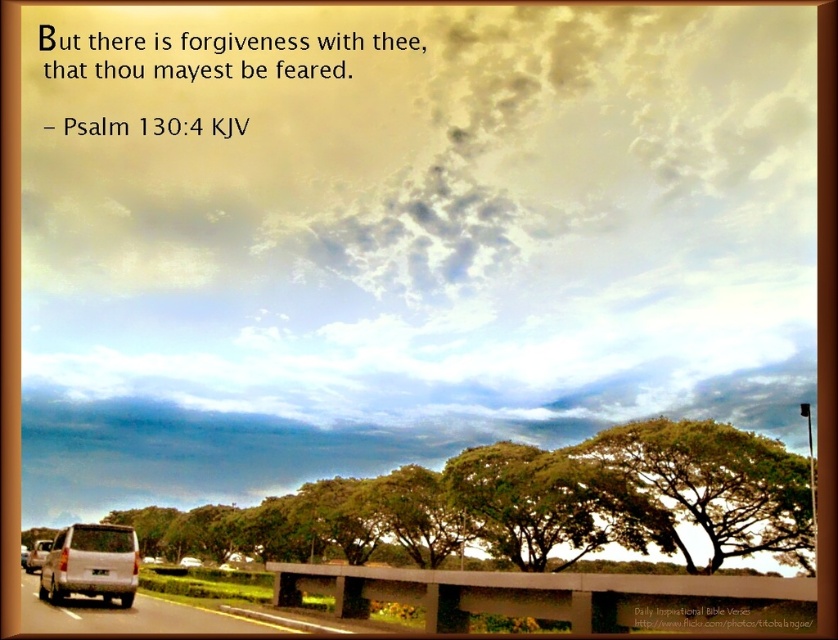
Question: Is silver metallic van at lower left positioned in front of metallic silver car at lower left?

Choices:
 (A) no
 (B) yes

Answer: (B)

Question: Estimate the real-world distances between objects in this image. Which object is closer to the silver metallic van at lower left?

Choices:
 (A) metallic silver car at lower left
 (B) green leafy tree at center

Answer: (A)

Question: Which point is closer to the camera taking this photo?

Choices:
 (A) (83, 525)
 (B) (27, 563)
 (C) (789, 545)

Answer: (A)

Question: Can you confirm if silver metallic van at lower left is positioned above metallic silver car at lower left?

Choices:
 (A) no
 (B) yes

Answer: (B)

Question: Can you confirm if green leafy tree at center is thinner than metallic silver car at lower left?

Choices:
 (A) yes
 (B) no

Answer: (A)

Question: Which point is farther to the camera?

Choices:
 (A) (74, 556)
 (B) (810, 570)

Answer: (B)